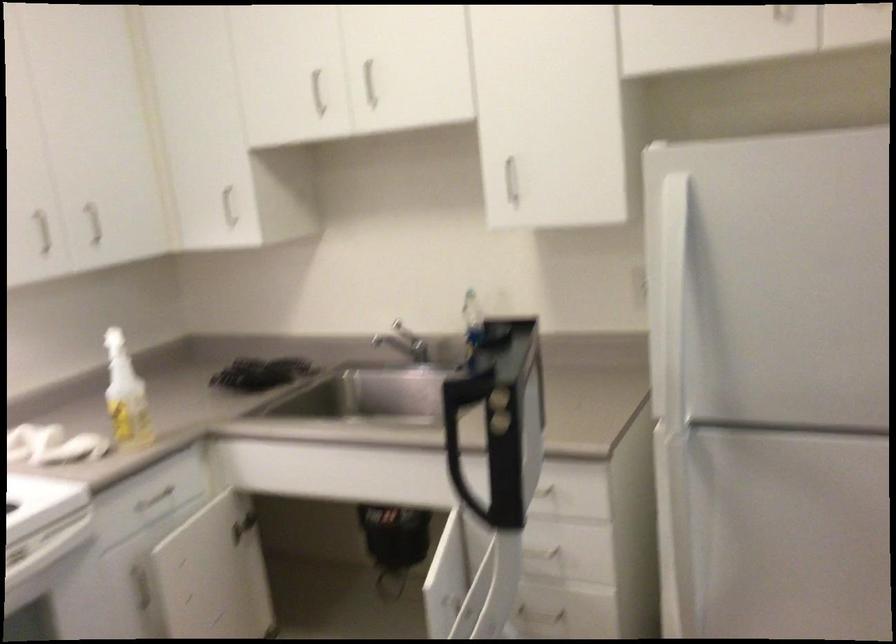
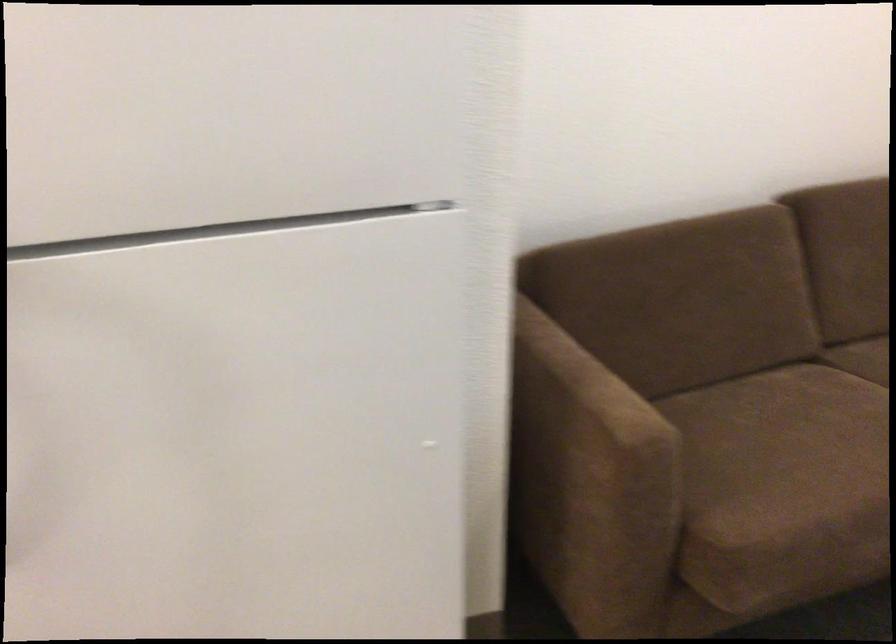
Question: The camera is either moving clockwise (left) or counter-clockwise (right) around the object. The first image is from the beginning of the video and the second image is from the end. Is the camera moving left or right when shooting the video?

Choices:
 (A) Left
 (B) Right

Answer: (A)